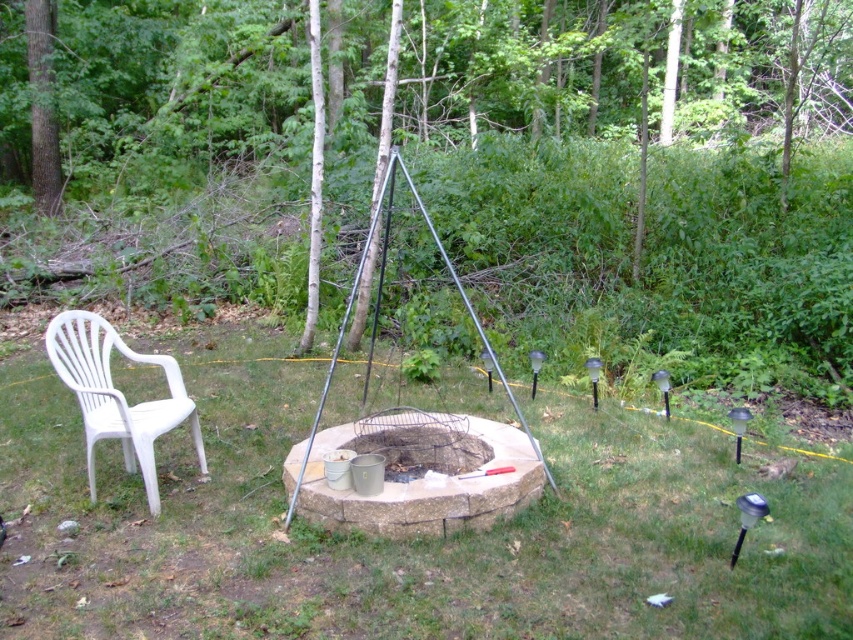
Is brown wood tree at center bigger than white plastic chair at left?

Correct, brown wood tree at center is larger in size than white plastic chair at left.

Can you confirm if brown wood tree at center is wider than white plastic chair at left?

Yes.

Who is more distant from viewer, (158, 45) or (84, 428)?

The point (158, 45) is behind.

Find the location of `brown wood tree at center`. brown wood tree at center is located at coordinates (583, 68).